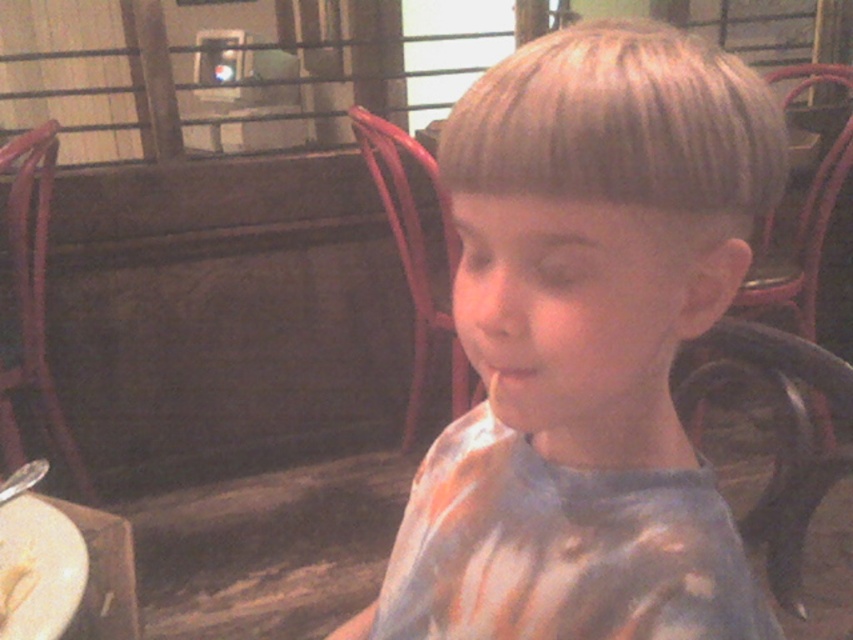
Question: Which point is farther to the camera?

Choices:
 (A) (630, 60)
 (B) (18, 586)

Answer: (B)

Question: Based on their relative distances, which object is nearer to the light blue tie-dye shirt at center?

Choices:
 (A) white creamy food at lower left
 (B) white matte plate at lower left

Answer: (B)

Question: Does light blue tie-dye shirt at center appear under white matte plate at lower left?

Choices:
 (A) no
 (B) yes

Answer: (A)

Question: Which object is positioned farthest from the light blue tie-dye shirt at center?

Choices:
 (A) white matte plate at lower left
 (B) white creamy food at lower left

Answer: (B)

Question: Does light blue tie-dye shirt at center appear on the right side of white creamy food at lower left?

Choices:
 (A) no
 (B) yes

Answer: (B)

Question: Does white matte plate at lower left appear on the left side of white creamy food at lower left?

Choices:
 (A) yes
 (B) no

Answer: (B)